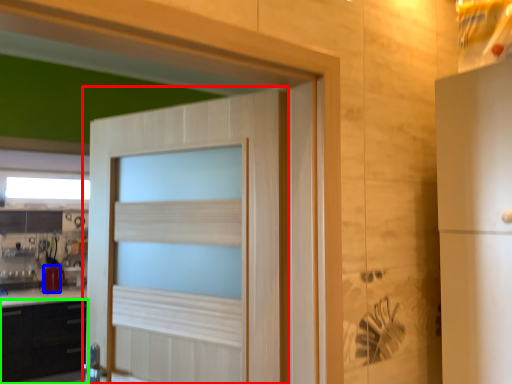
Question: Which object is positioned farthest from door (highlighted by a red box)? Select from appliance (highlighted by a blue box) and cabinetry (highlighted by a green box).

Choices:
 (A) appliance
 (B) cabinetry

Answer: (A)